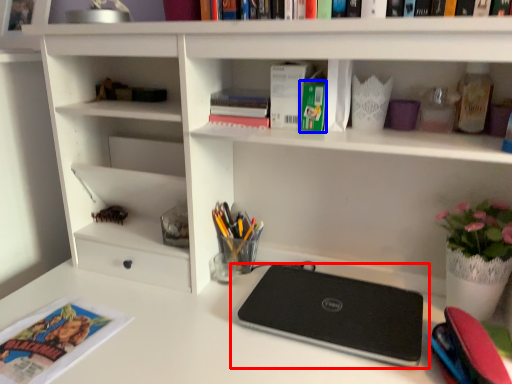
Question: Which of the following is the farthest to the observer, laptop (highlighted by a red box) or paperback book (highlighted by a blue box)?

Choices:
 (A) laptop
 (B) paperback book

Answer: (B)